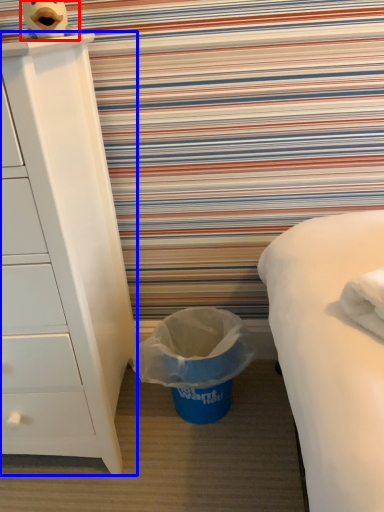
Question: Which point is further to the camera, toy (highlighted by a red box) or chest of drawers (highlighted by a blue box)?

Choices:
 (A) toy
 (B) chest of drawers

Answer: (A)